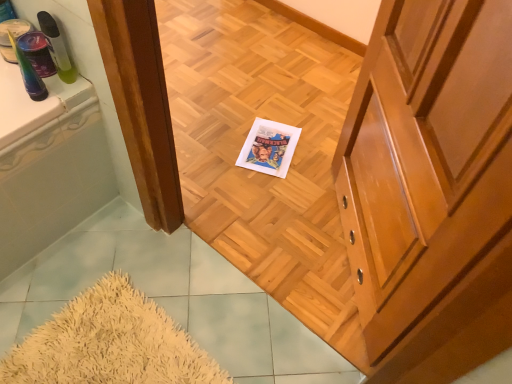
Question: From the image's perspective, is translucent plastic cup at upper left, the first toiletry viewed from the left, above translucent plastic spray bottle at upper left, which ranks as the second toiletry in left-to-right order?

Choices:
 (A) no
 (B) yes

Answer: (A)

Question: Does translucent plastic cup at upper left, which ranks as the 2th toiletry in right-to-left order, come in front of translucent plastic spray bottle at upper left, which ranks as the second toiletry in left-to-right order?

Choices:
 (A) no
 (B) yes

Answer: (B)

Question: Is translucent plastic cup at upper left, which ranks as the 2th toiletry in right-to-left order, facing away from translucent plastic spray bottle at upper left, which ranks as the second toiletry in left-to-right order?

Choices:
 (A) yes
 (B) no

Answer: (A)

Question: Can translucent plastic spray bottle at upper left, which ranks as the second toiletry in left-to-right order, be found inside translucent plastic cup at upper left, which ranks as the 2th toiletry in right-to-left order?

Choices:
 (A) yes
 (B) no

Answer: (B)

Question: From a real-world perspective, is translucent plastic cup at upper left, which ranks as the 2th toiletry in right-to-left order, beneath translucent plastic spray bottle at upper left, which ranks as the second toiletry in left-to-right order?

Choices:
 (A) no
 (B) yes

Answer: (B)

Question: In terms of height, does translucent plastic cup at upper left, which ranks as the 2th toiletry in right-to-left order, look taller or shorter compared to translucent plastic spray bottle at upper left, marked as the 1th toiletry in a right-to-left arrangement?

Choices:
 (A) short
 (B) tall

Answer: (B)

Question: In terms of size, does translucent plastic cup at upper left, the first toiletry viewed from the left, appear bigger or smaller than translucent plastic spray bottle at upper left, which ranks as the second toiletry in left-to-right order?

Choices:
 (A) big
 (B) small

Answer: (A)

Question: Is translucent plastic cup at upper left, the first toiletry viewed from the left, inside the boundaries of translucent plastic spray bottle at upper left, marked as the 1th toiletry in a right-to-left arrangement, or outside?

Choices:
 (A) inside
 (B) outside

Answer: (B)

Question: Considering their positions, is translucent plastic cup at upper left, which ranks as the 2th toiletry in right-to-left order, located in front of or behind translucent plastic spray bottle at upper left, marked as the 1th toiletry in a right-to-left arrangement?

Choices:
 (A) front
 (B) behind

Answer: (A)

Question: Considering the positions of translucent plastic spray bottle at upper left, which ranks as the second toiletry in left-to-right order, and translucent plastic cup at upper left, which ranks as the 2th toiletry in right-to-left order, in the image, is translucent plastic spray bottle at upper left, which ranks as the second toiletry in left-to-right order, wider or thinner than translucent plastic cup at upper left, which ranks as the 2th toiletry in right-to-left order,?

Choices:
 (A) thin
 (B) wide

Answer: (A)

Question: Would you say translucent plastic spray bottle at upper left, which ranks as the second toiletry in left-to-right order, is inside or outside translucent plastic cup at upper left, the first toiletry viewed from the left?

Choices:
 (A) outside
 (B) inside

Answer: (A)

Question: Considering their positions, is translucent plastic spray bottle at upper left, which ranks as the second toiletry in left-to-right order, located in front of or behind translucent plastic cup at upper left, the first toiletry viewed from the left?

Choices:
 (A) behind
 (B) front

Answer: (A)

Question: Is translucent plastic spray bottle at upper left, which ranks as the second toiletry in left-to-right order, to the left or to the right of translucent plastic cup at upper left, the first toiletry viewed from the left, in the image?

Choices:
 (A) left
 (B) right

Answer: (B)

Question: Is translucent plastic cup at upper left, the first toiletry viewed from the left, situated inside shiny wood cabinet at right or outside?

Choices:
 (A) outside
 (B) inside

Answer: (A)

Question: Looking at the image, does translucent plastic cup at upper left, the first toiletry viewed from the left, seem bigger or smaller compared to shiny wood cabinet at right?

Choices:
 (A) big
 (B) small

Answer: (B)